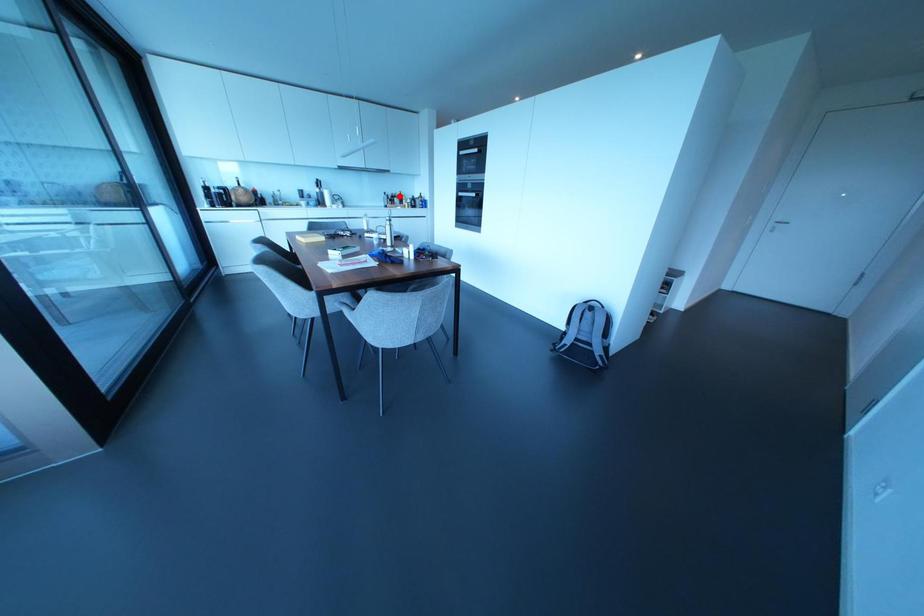
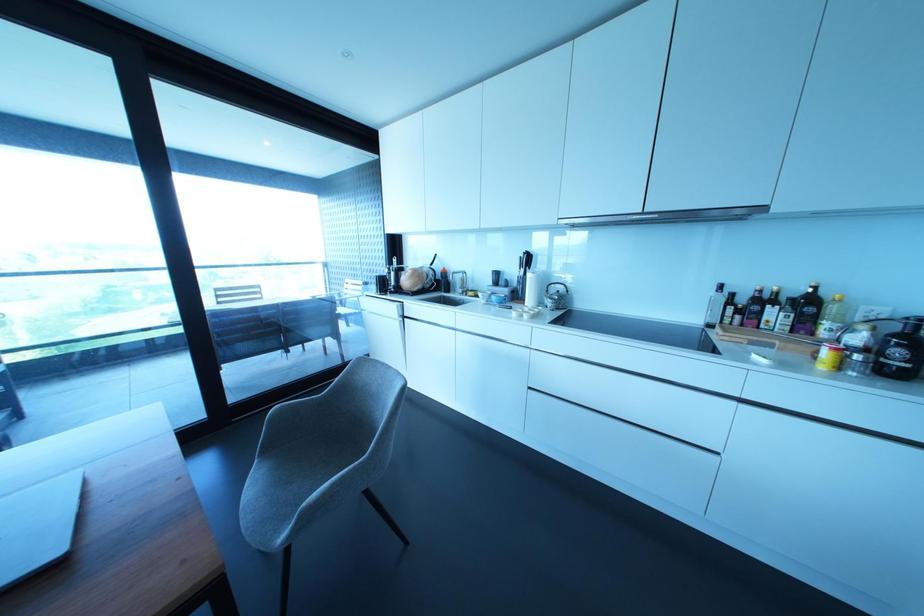
Find the pixel in the second image that matches the highlighted location in the first image.

(807, 304)